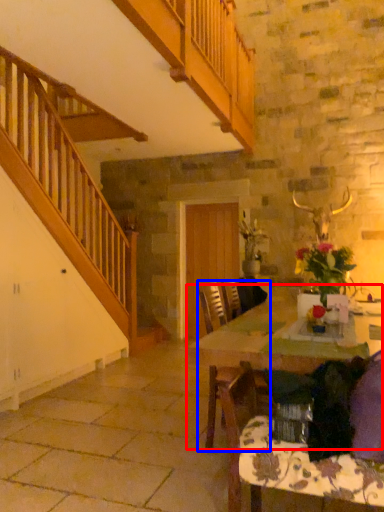
Question: Among these objects, which one is nearest to the camera, table (highlighted by a red box) or chair (highlighted by a blue box)?

Choices:
 (A) table
 (B) chair

Answer: (A)